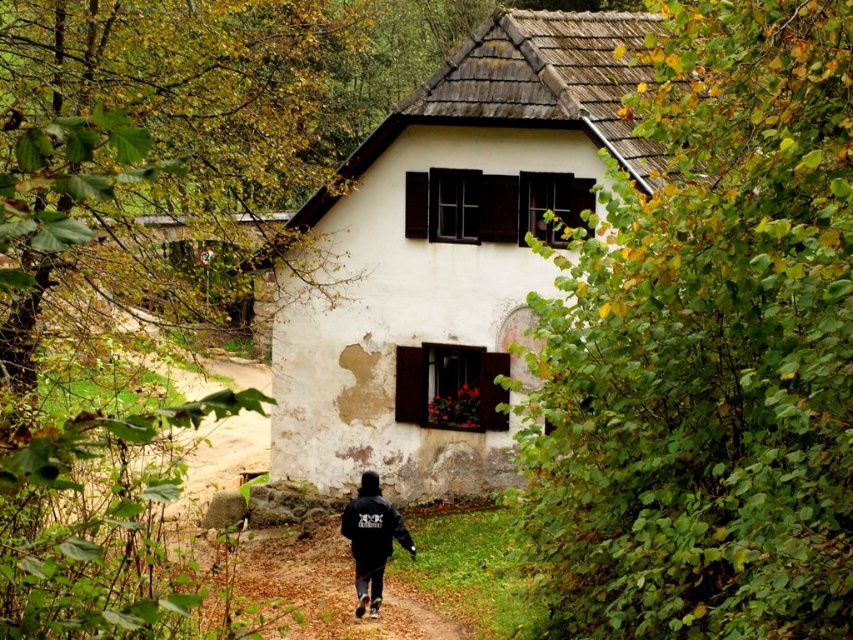
Question: Is black matte jacket at lower center wider than black matte sweatshirt at lower center?

Choices:
 (A) no
 (B) yes

Answer: (A)

Question: Is black matte jacket at lower center wider than black matte sweatshirt at lower center?

Choices:
 (A) yes
 (B) no

Answer: (B)

Question: Does black matte jacket at lower center have a smaller size compared to black matte sweatshirt at lower center?

Choices:
 (A) no
 (B) yes

Answer: (A)

Question: Which point is farther from the camera taking this photo?

Choices:
 (A) (376, 547)
 (B) (405, 531)

Answer: (A)